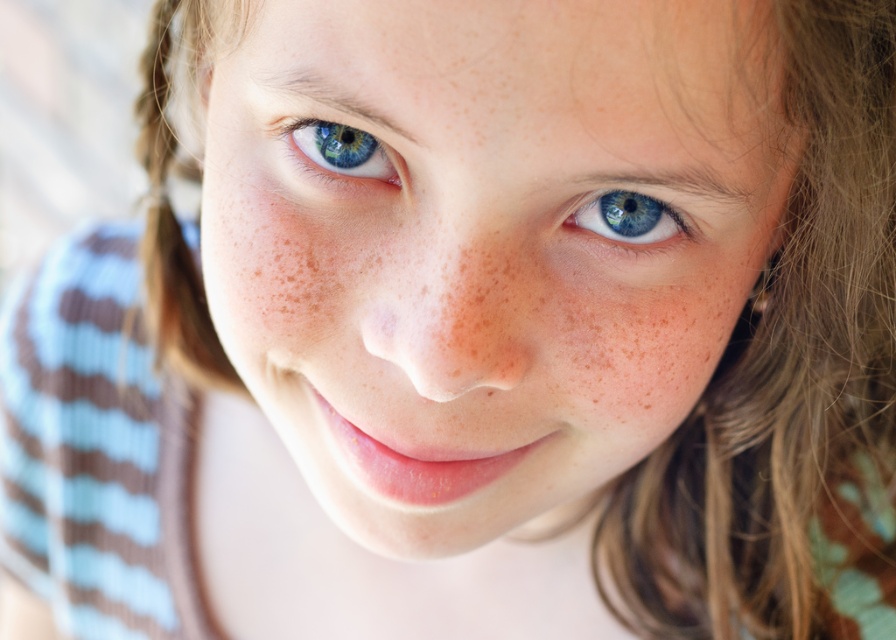
Is smooth skin face at center above blue glossy eye at upper left?

No.

Is smooth skin face at center wider than blue glossy eye at upper left?

Yes.

What do you see at coordinates (485, 244) in the screenshot? I see `smooth skin face at center` at bounding box center [485, 244].

Identify the location of smooth skin face at center. The image size is (896, 640). (485, 244).

How distant is smooth skin face at center from blue glossy eye at center?

smooth skin face at center and blue glossy eye at center are 3.35 inches apart.

Can you confirm if smooth skin face at center is positioned to the right of blue glossy eye at center?

Incorrect, smooth skin face at center is not on the right side of blue glossy eye at center.

Which is behind, point (494, 248) or point (647, 196)?

Point (647, 196)

Identify the location of smooth skin face at center. Image resolution: width=896 pixels, height=640 pixels. (485, 244).

Describe the element at coordinates (342, 150) in the screenshot. I see `blue glossy eye at upper left` at that location.

Is point (323, 150) closer to viewer compared to point (600, 196)?

That is False.

I want to click on blue glossy eye at upper left, so click(x=342, y=150).